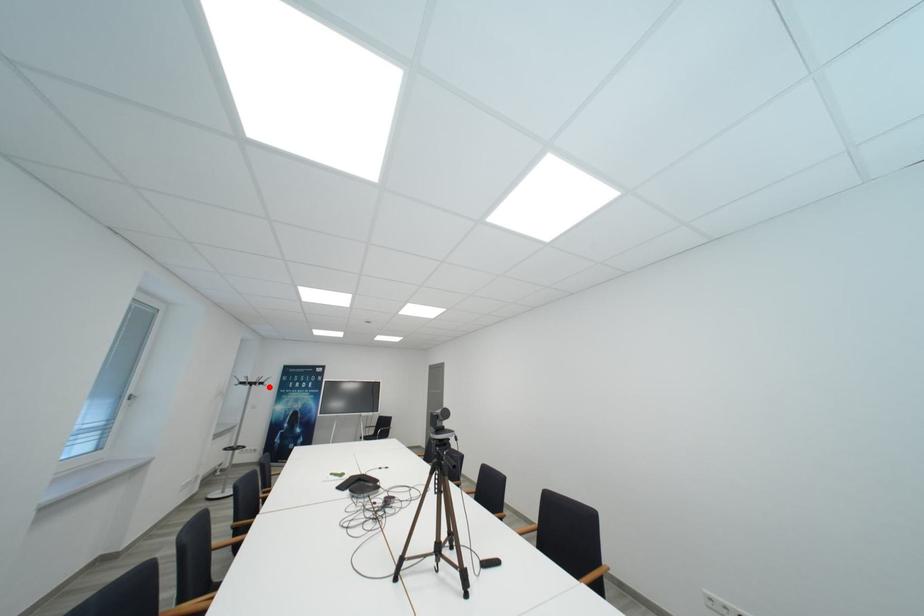
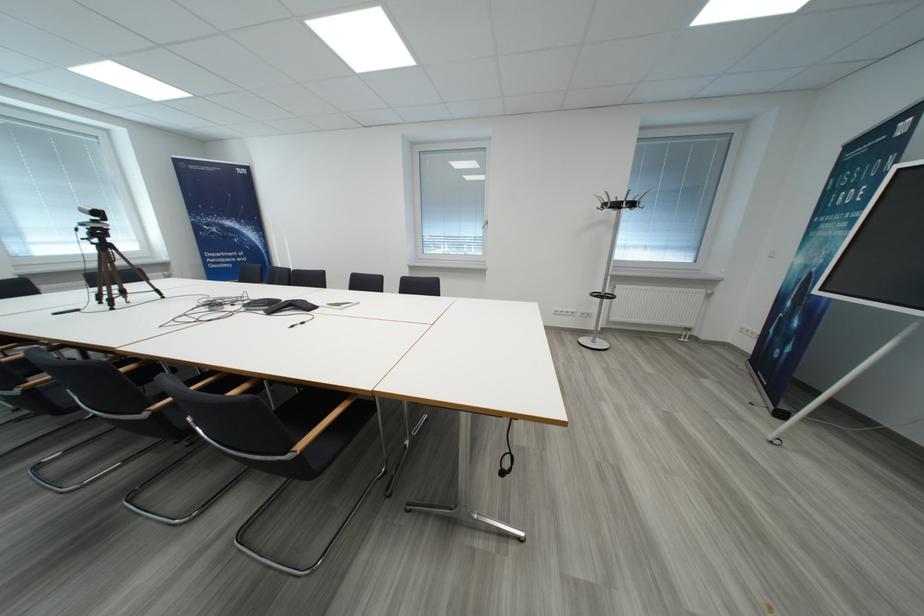
Locate, in the second image, the point that corresponds to the highlighted location in the first image.

(623, 208)